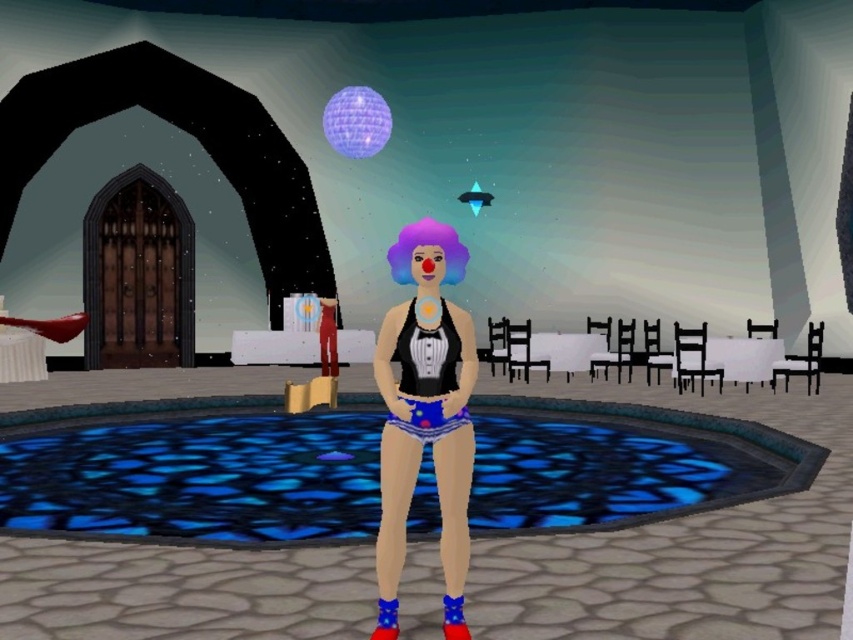
Question: Which point appears farthest from the camera in this image?

Choices:
 (A) (434, 426)
 (B) (254, 173)
 (C) (322, 518)

Answer: (B)

Question: Is stained glass pool at center above lavender glossy disco ball at upper center?

Choices:
 (A) yes
 (B) no

Answer: (B)

Question: Which of the following is the farthest from the observer?

Choices:
 (A) (453, 429)
 (B) (421, 422)
 (C) (370, 99)
 (D) (426, 216)

Answer: (C)

Question: Which point appears closest to the camera in this image?

Choices:
 (A) (408, 252)
 (B) (444, 433)
 (C) (502, 476)

Answer: (B)

Question: Can you confirm if purple synthetic wig at center is wider than blue satin shorts at center?

Choices:
 (A) no
 (B) yes

Answer: (B)

Question: Can you confirm if stained glass pool at center is wider than wooden door at left?

Choices:
 (A) no
 (B) yes

Answer: (B)